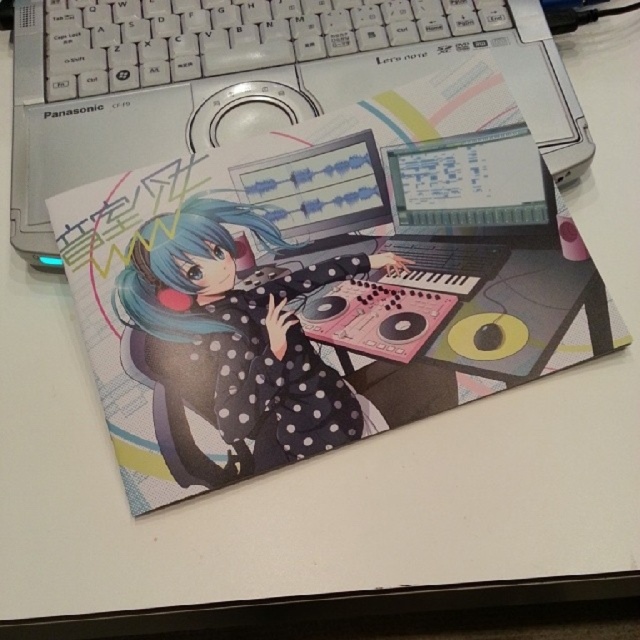
Does polka dot fabric girl at center have a lesser width compared to blue matte hair at center?

In fact, polka dot fabric girl at center might be wider than blue matte hair at center.

Does point (179, 253) lie in front of point (250, 224)?

Yes, point (179, 253) is in front of point (250, 224).

Between point (172, 330) and point (205, 230), which one is positioned in front?

Point (172, 330) is more forward.

You are a GUI agent. You are given a task and a screenshot of the screen. Output one action in this format:
    pyautogui.click(x=<x>, y=<y>)
    Task: Click on the polka dot fabric girl at center
    This screenshot has height=640, width=640.
    Given the screenshot: What is the action you would take?
    pyautogui.click(x=241, y=333)

Can you confirm if white plastic keyboard at upper center is wider than blue matte hair at center?

Yes.

Between white plastic keyboard at upper center and blue matte hair at center, which one appears on the left side from the viewer's perspective?

blue matte hair at center is more to the left.

This screenshot has width=640, height=640. What are the coordinates of `white plastic keyboard at upper center` in the screenshot? It's located at [x=244, y=36].

In order to click on white plastic keyboard at upper center in this screenshot , I will do `click(244, 36)`.

Which is behind, point (477, 241) or point (170, 243)?

The point (170, 243) is behind.

Who is taller, matte black laptop at center or blue matte hair at center?

Standing taller between the two is matte black laptop at center.

Is point (476, 218) positioned behind point (152, 284)?

Yes, point (476, 218) is behind point (152, 284).

The width and height of the screenshot is (640, 640). I want to click on matte black laptop at center, so click(472, 189).